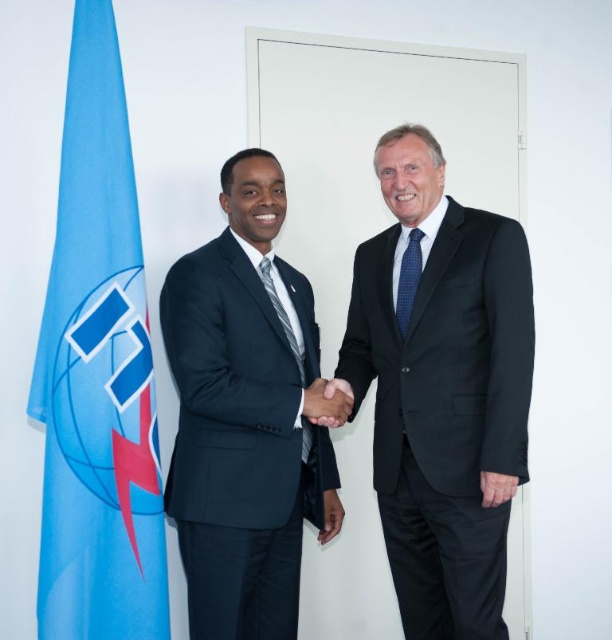
In the scene where two people are shaking hands in a formal setting, which object is positioned to the right of the other between the black smooth hand at center and the striped fabric tie at center?

The black smooth hand at center is to the right of the striped fabric tie at center.

You are a photographer at a formal event. You need to capture a closeup shot of the blue dotted tie at center without including the black smooth hand at center in the frame. Is this possible given their current positions?

The black smooth hand at center is positioned under the blue dotted tie at center, so it is possible to frame the blue dotted tie at center without including the hand by adjusting the camera angle slightly upward.